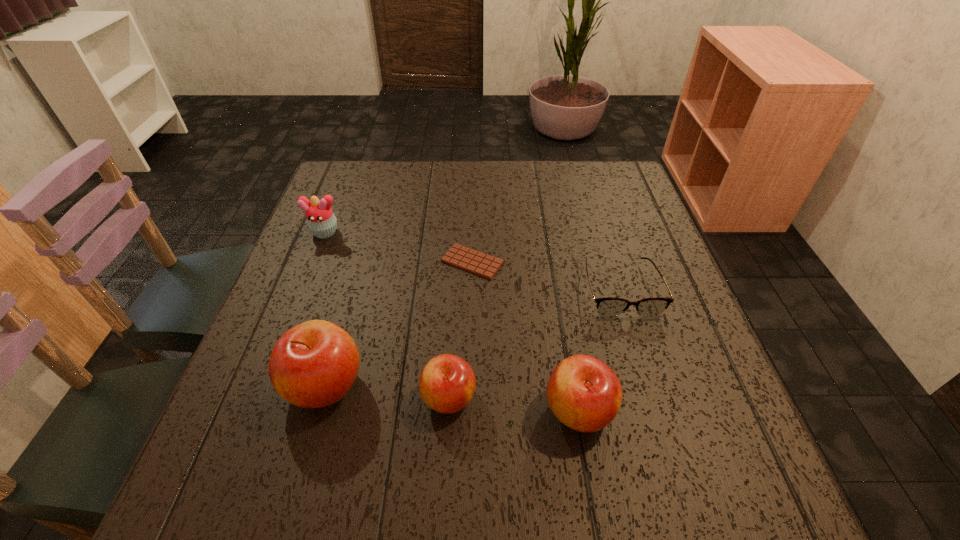
Identify the location of free spot at the left edge of the desktop. This screenshot has width=960, height=540. (295, 317).

The width and height of the screenshot is (960, 540). In order to click on vacant position at the right edge of the desktop in this screenshot , I will do `click(682, 299)`.

Where is `vacant space at the far left corner of the desktop`? vacant space at the far left corner of the desktop is located at coordinates (337, 180).

The image size is (960, 540). I want to click on vacant region at the far right corner of the desktop, so click(x=621, y=191).

Image resolution: width=960 pixels, height=540 pixels. I want to click on vacant space at the near right corner of the desktop, so click(669, 408).

At what (x,y) coordinates should I click in order to perform the action: click on empty space that is in between the fifth tallest object and the shortest object. Please return your answer as a coordinate pair (x, y). Looking at the image, I should click on (546, 275).

In order to click on vacant area that lies between the farthest object and the shortest object in this screenshot , I will do `click(398, 247)`.

Locate an element on the screen. vacant area between the second shortest object and the candy bar is located at coordinates (x=546, y=275).

Locate an element on the screen. Image resolution: width=960 pixels, height=540 pixels. vacant area between the spectacles and the rightmost apple is located at coordinates (599, 349).

In order to click on free space between the spectacles and the rightmost apple in this screenshot , I will do `click(599, 349)`.